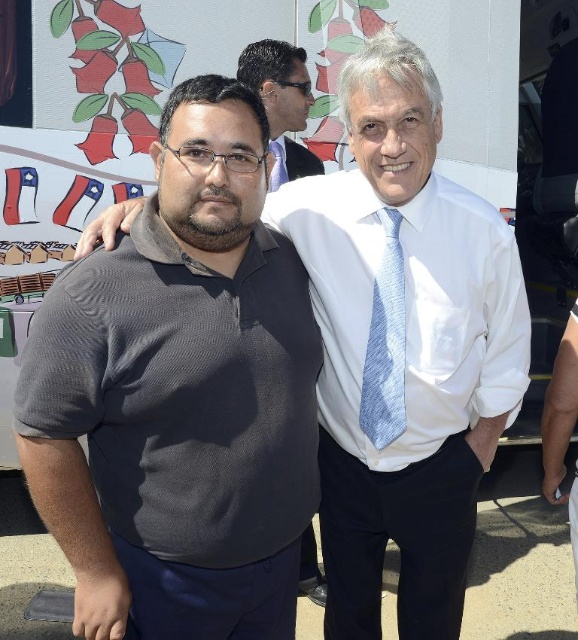
You are standing in front of the mural and want to take a photo of both the matte black shirt at upper center and the other person. How far apart should you position them to ensure both fit in the frame?

The two individuals are 9.79 feet apart, so you should position them at that distance to ensure both the matte black shirt at upper center and the other person fit in the frame.

You are a photographer taking a picture of the two men in front of the mural. You notice a point at coordinates (281, 104). Which object from the scene is this point located on?

The point at coordinates (281, 104) is located on the matte black shirt at upper center.

You are a photographer adjusting your camera settings. You notice the dark gray knit polo shirt at left and the light blue textured tie at center in your frame. Which object should you focus on first to ensure both are in sharp focus?

You should focus on the dark gray knit polo shirt at left first because it is closer to the viewer than the light blue textured tie at center, so starting with the closer object will help achieve focus on both.